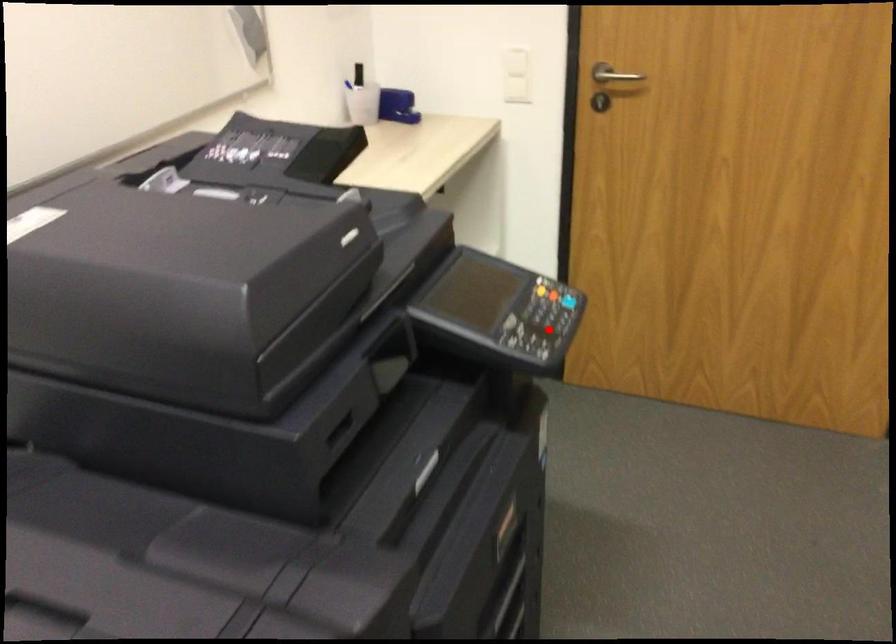
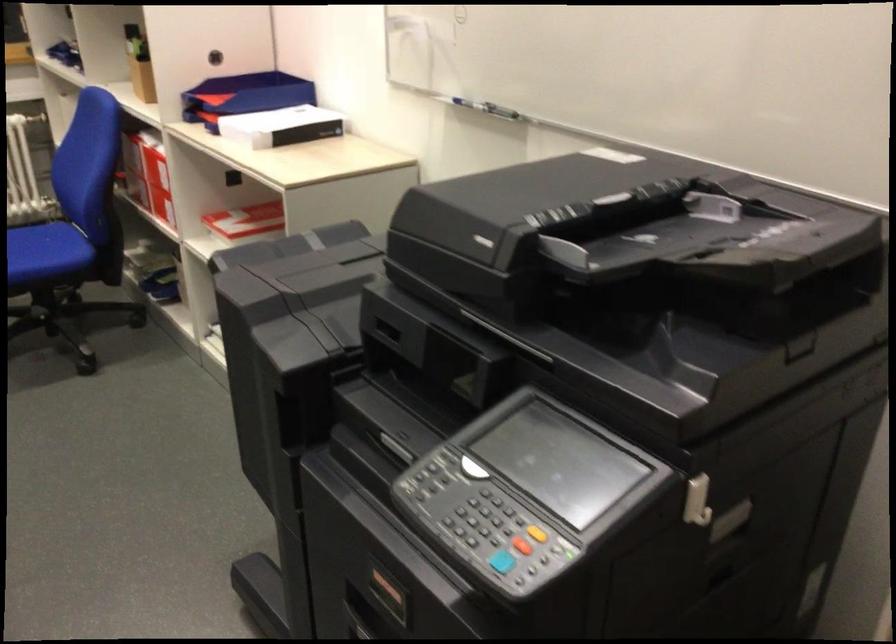
In the second image, find the point that corresponds to the highlighted location in the first image.

(521, 545)